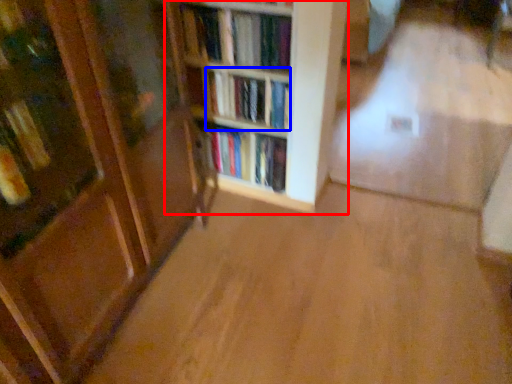
Question: Which of the following is the closest to the observer, shelf (highlighted by a red box) or book (highlighted by a blue box)?

Choices:
 (A) shelf
 (B) book

Answer: (A)